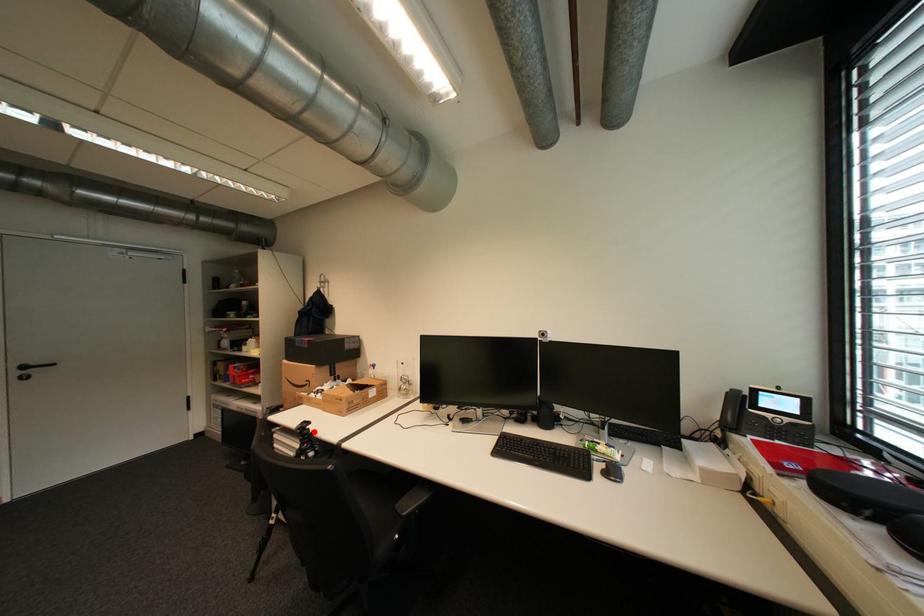
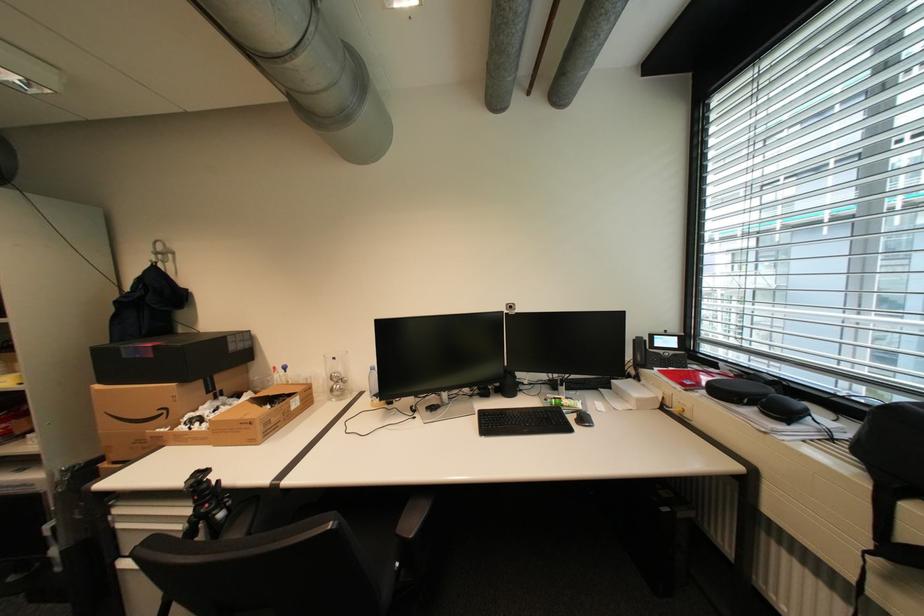
Find the pixel in the second image that matches the highlighted location in the first image.

(213, 485)